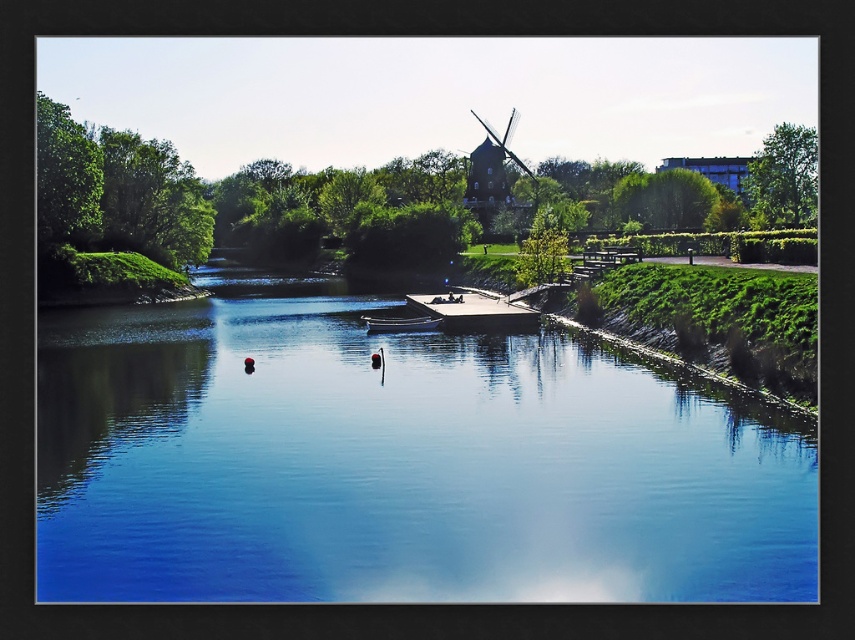
You are a photographer planning to capture the entire blue glossy boat at center and the blue smooth water at center in one frame. Given that your camera can only accommodate objects up to the width of the boat, will you be able to fit both in the frame?

The blue smooth water at center has a larger width than the blue glossy boat at center. Since the camera can only accommodate up to the boat width, the water is wider and won not fit entirely in the frame.

You are standing at the edge of the riverside scene and want to walk towards the two points marked in the image. Which point would you reach first, point (576, 516) or point (382, 317)?

Point (576, 516) is in front of point (382, 317), so you would reach point (576, 516) first.